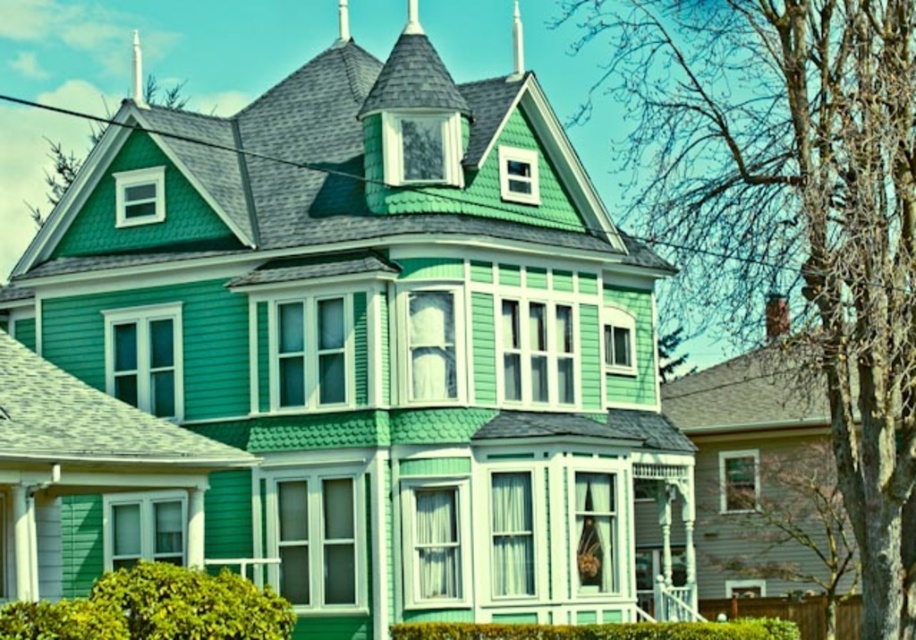
Question: Among these objects, which one is nearest to the camera?

Choices:
 (A) metallic spire at upper center
 (B) smooth white spire at upper center

Answer: (B)

Question: Which point is closer to the camera?

Choices:
 (A) (341, 24)
 (B) (513, 1)

Answer: (A)

Question: Can you confirm if smooth white spire at upper center is thinner than metallic spire at upper center?

Choices:
 (A) yes
 (B) no

Answer: (A)

Question: Can you confirm if smooth white spire at upper center is bigger than metallic spire at upper center?

Choices:
 (A) yes
 (B) no

Answer: (B)

Question: Does smooth white spire at upper center lie behind metallic spire at upper center?

Choices:
 (A) yes
 (B) no

Answer: (B)